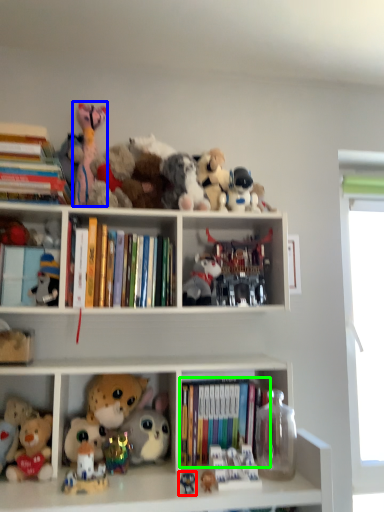
Question: Based on their relative distances, which object is farther from toy (highlighted by a red box)? Choose from toy (highlighted by a blue box) and book (highlighted by a green box).

Choices:
 (A) toy
 (B) book

Answer: (A)